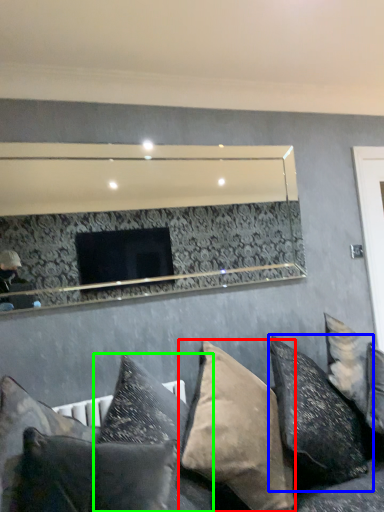
Question: Estimate the real-world distances between objects in this image. Which object is farther from pillow (highlighted by a red box), pillow (highlighted by a blue box) or pillow (highlighted by a green box)?

Choices:
 (A) pillow
 (B) pillow

Answer: (A)